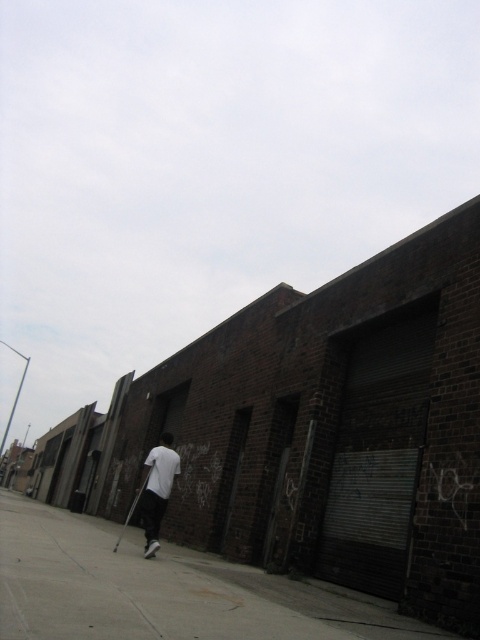
Question: Can you confirm if gray concrete sidewalk at lower center is wider than white matte shirt at center?

Choices:
 (A) no
 (B) yes

Answer: (B)

Question: Which of the following is the closest to the observer?

Choices:
 (A) gray concrete sidewalk at lower center
 (B) white matte shirt at center

Answer: (A)

Question: Which point appears farthest from the camera in this image?

Choices:
 (A) (155, 634)
 (B) (168, 490)

Answer: (B)

Question: Does gray concrete sidewalk at lower center appear on the right side of white matte shirt at center?

Choices:
 (A) yes
 (B) no

Answer: (A)

Question: Can you confirm if gray concrete sidewalk at lower center is positioned above white matte shirt at center?

Choices:
 (A) no
 (B) yes

Answer: (A)